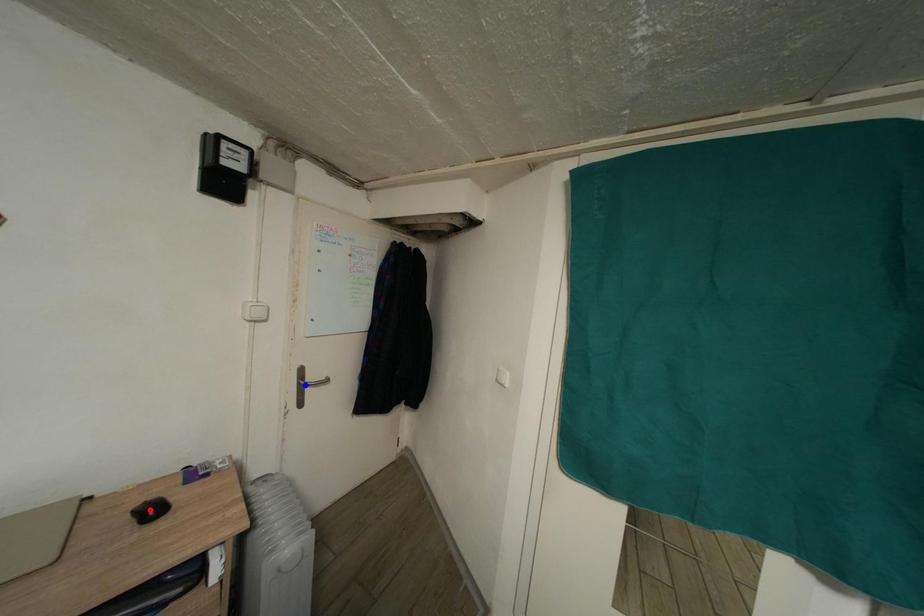
Question: In the image, two points are highlighted. Which point is nearer to the camera? Reply with the corresponding letter.

Choices:
 (A) blue point
 (B) red point

Answer: (B)